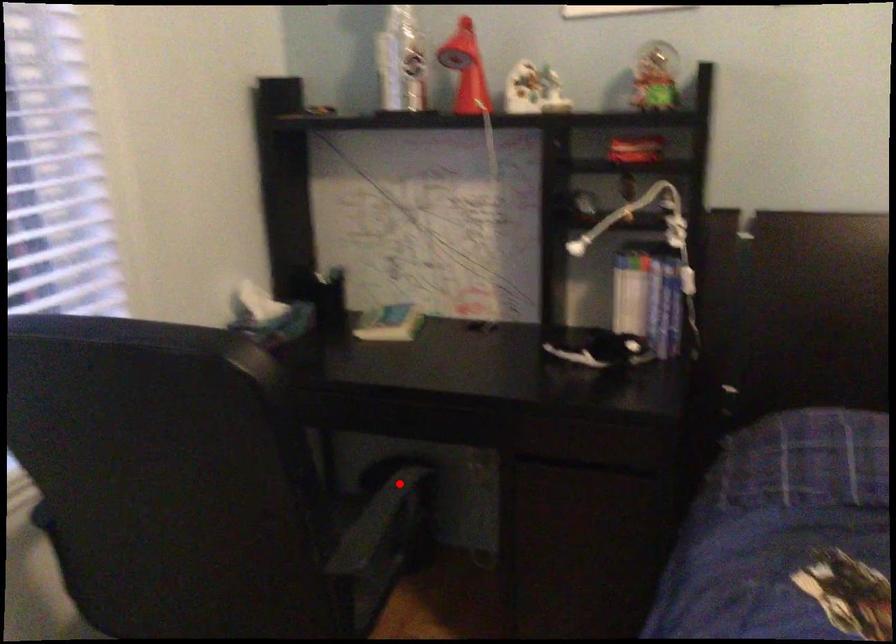
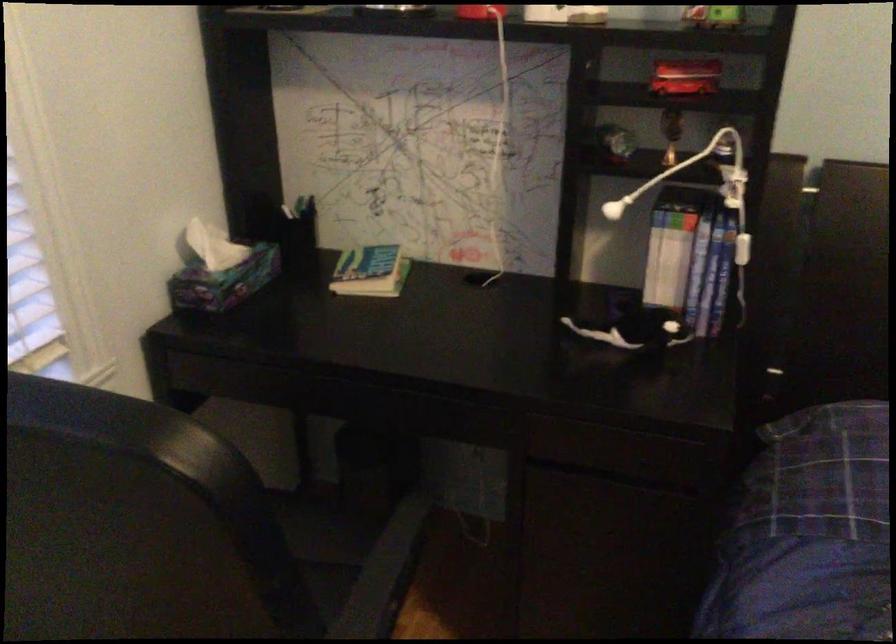
Question: I am providing you with two images of the same scene from different viewpoints. A red point is shown in image1. For the corresponding object point in image2, is it positioned nearer or farther from the camera?

Choices:
 (A) Nearer
 (B) Farther

Answer: (A)